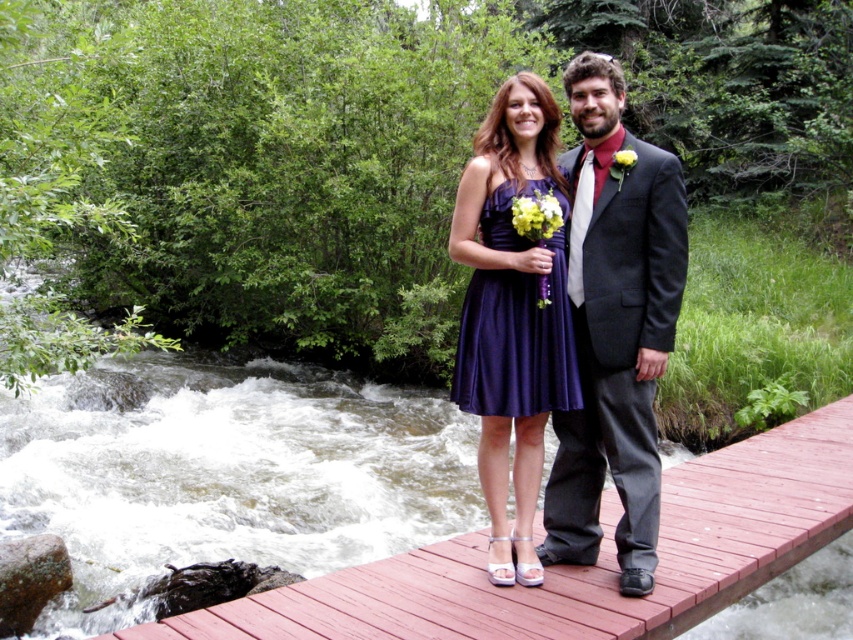
Does dark gray suit at center appear under purple satin dress at center?

Indeed, dark gray suit at center is positioned under purple satin dress at center.

Which is more to the left, dark gray suit at center or purple satin dress at center?

Positioned to the left is purple satin dress at center.

Looking at this image, who is more distant from viewer, [643,163] or [556,232]?

The point [643,163] is more distant.

Identify the location of dark gray suit at center. This screenshot has width=853, height=640. (614, 328).

Does wooden bridge at center have a lesser height compared to satin dress at center?

Yes, wooden bridge at center is shorter than satin dress at center.

Which of these two, wooden bridge at center or satin dress at center, stands taller?

satin dress at center is taller.

Where is `wooden bridge at center`? wooden bridge at center is located at coordinates (581, 566).

Is wooden bridge at center shorter than matte purple bouquet at center?

No, wooden bridge at center is not shorter than matte purple bouquet at center.

Where is `wooden bridge at center`? Image resolution: width=853 pixels, height=640 pixels. wooden bridge at center is located at coordinates (581, 566).